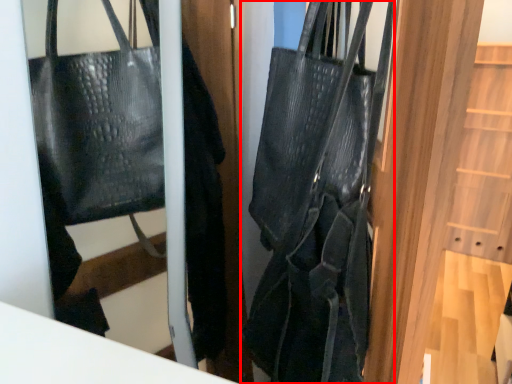
Question: From the image's perspective, where is handbag (annotated by the red box) located relative to door?

Choices:
 (A) below
 (B) above

Answer: (A)